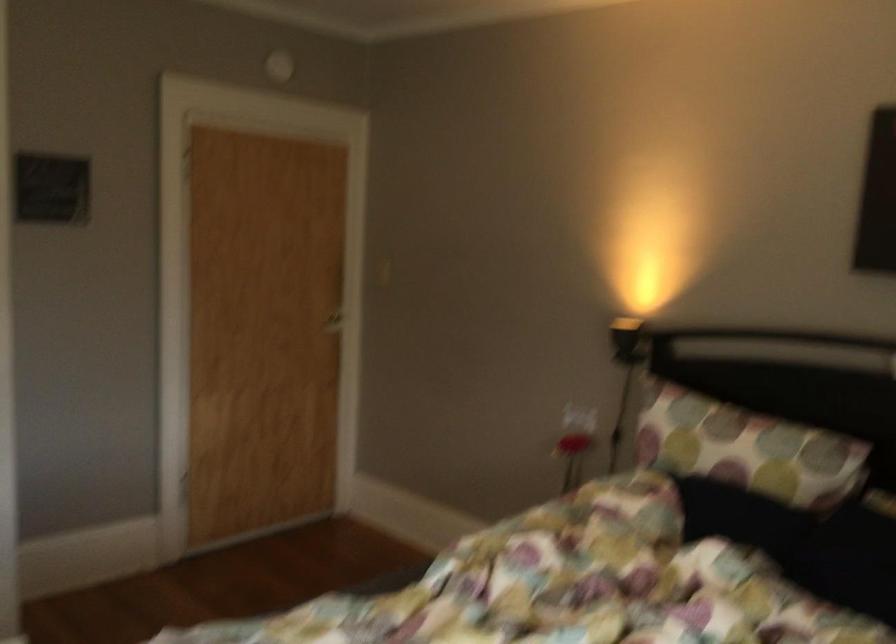
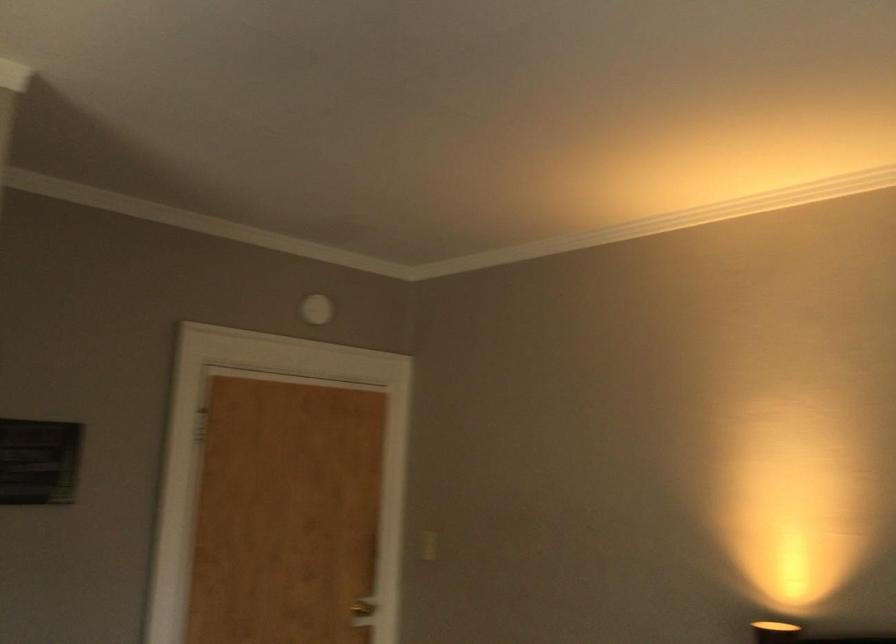
Question: The images are taken continuously from a first-person perspective. In which direction is your viewpoint rotating?

Choices:
 (A) Left
 (B) Right
 (C) Up
 (D) Down

Answer: (C)